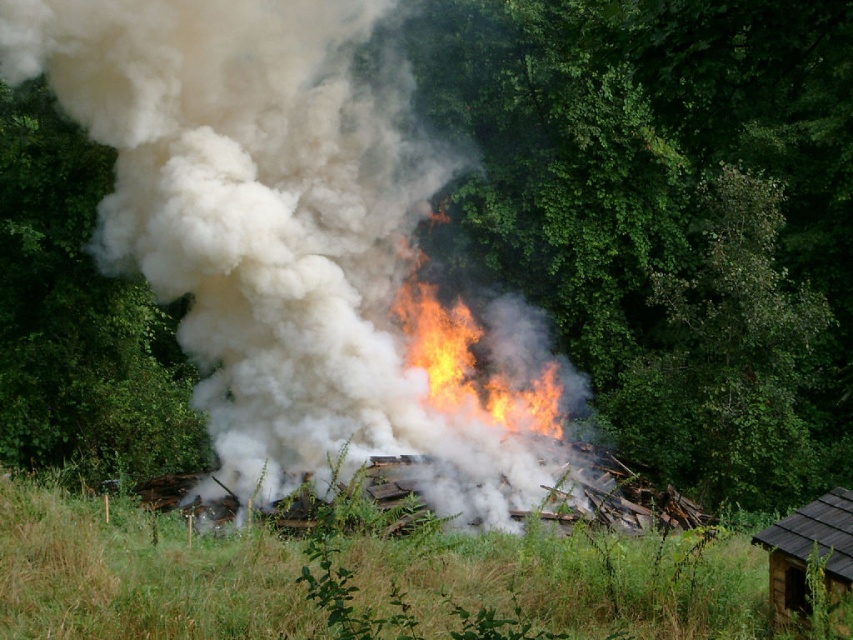
Which is above, green grass at lower center or green leafy tree at left?

green leafy tree at left is higher up.

Does point (86, 552) lie in front of point (39, 310)?

Yes, it is.

The width and height of the screenshot is (853, 640). I want to click on green grass at lower center, so click(x=140, y=573).

You are a GUI agent. You are given a task and a screenshot of the screen. Output one action in this format:
    pyautogui.click(x=<x>, y=<y>)
    Task: Click on the green grass at lower center
    The width and height of the screenshot is (853, 640).
    Given the screenshot: What is the action you would take?
    pyautogui.click(x=140, y=573)

Is green leafy tree at center smaller than green leafy tree at left?

Actually, green leafy tree at center might be larger than green leafy tree at left.

From the picture: Measure the distance between green leafy tree at center and green leafy tree at left.

11.34 meters

Does point (647, 116) lie in front of point (73, 282)?

No, (647, 116) is behind (73, 282).

The width and height of the screenshot is (853, 640). Identify the location of green leafy tree at center. (666, 216).

Does green grass at lower center appear on the right side of brown wooden hut at lower right?

Incorrect, green grass at lower center is not on the right side of brown wooden hut at lower right.

In order to click on green grass at lower center in this screenshot , I will do `click(140, 573)`.

Does point (619, 598) come in front of point (766, 534)?

That is False.

I want to click on green grass at lower center, so click(140, 573).